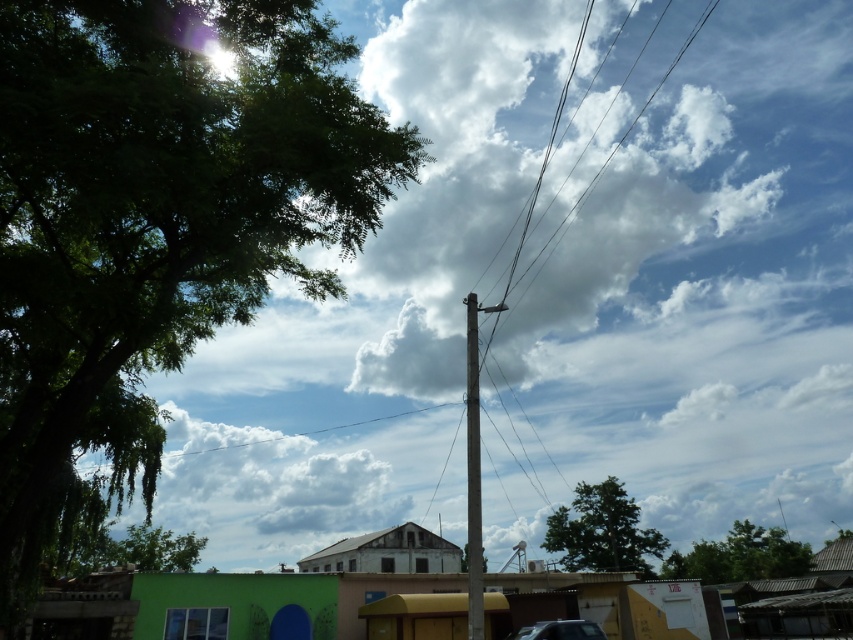
You are standing in the street scene and want to take a photo of both the green leafy tree at left and the green leafy tree at lower right. Which tree should you focus on first to ensure both are in sharp focus?

You should focus on the green leafy tree at left first because it is closer to you than the green leafy tree at lower right, so adjusting focus from near to far will help both be in sharp focus.

You are standing on the street and want to take a photo that includes both the point at coordinates point (595, 529) and the point at coordinates point (473, 461). Which point should you focus on first to ensure both are in focus?

You should focus on the point at coordinates point (473, 461) first because it is closer to you than the point at coordinates point (595, 529), which is further away. This ensures both points are within the depth of field.